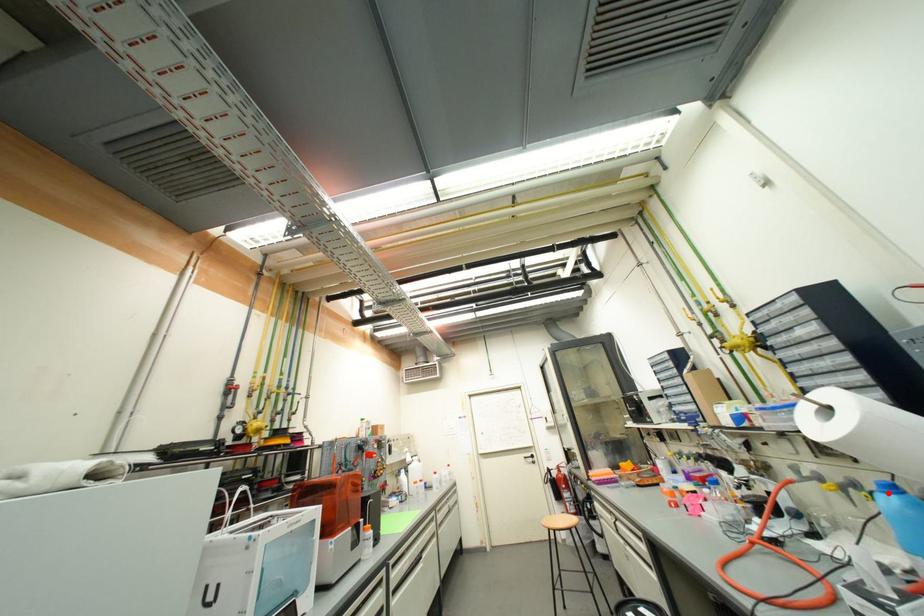
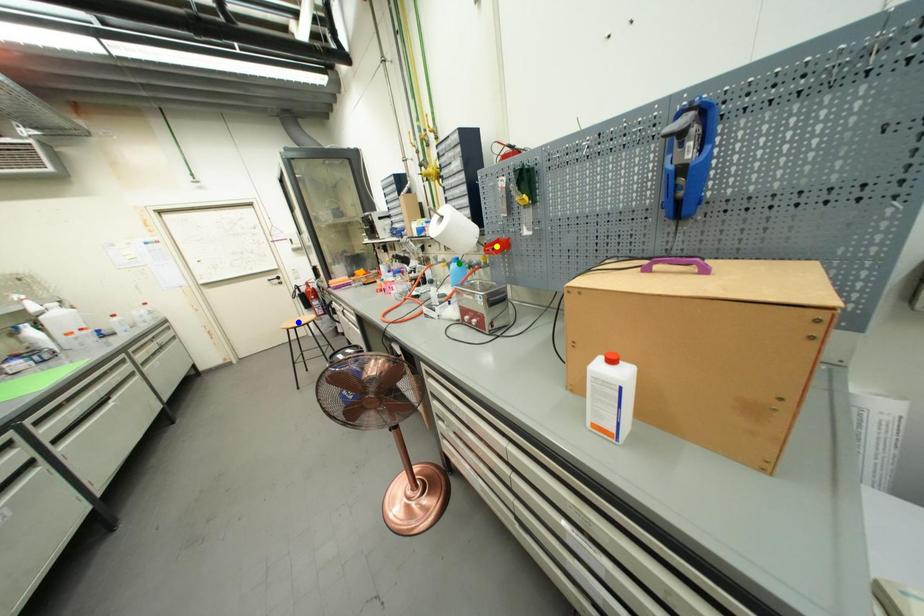
Question: I am providing you with two images of the same scene from different viewpoints. A red point is marked on the first image. You are given multiple points on the second image. Which spot in image 2 lines up with the point in image 1?

Choices:
 (A) blue point
 (B) green point
 (C) yellow point

Answer: (B)